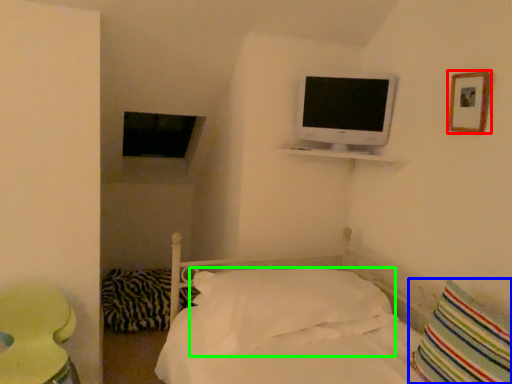
Question: Which object is the closest to the picture frame (highlighted by a red box)? Choose among these: pillow (highlighted by a blue box) or pillow (highlighted by a green box).

Choices:
 (A) pillow
 (B) pillow

Answer: (A)